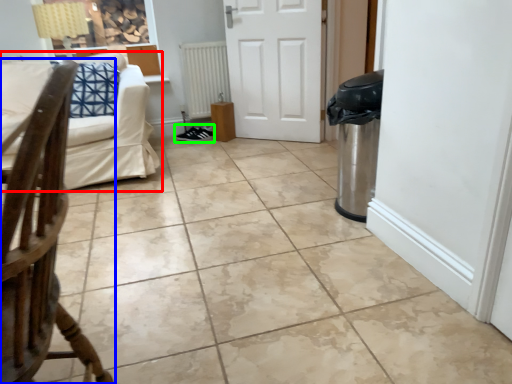
Question: Estimate the real-world distances between objects in this image. Which object is farther from studio couch (highlighted by a red box), chair (highlighted by a blue box) or footwear (highlighted by a green box)?

Choices:
 (A) chair
 (B) footwear

Answer: (A)